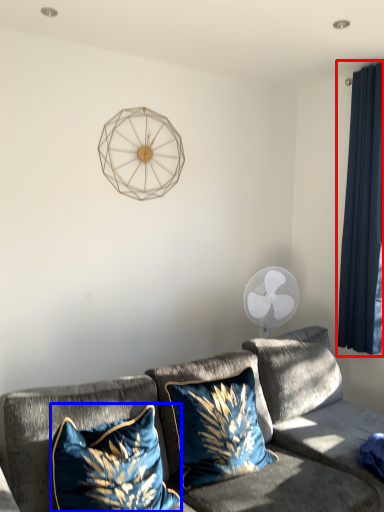
Question: Which of the following is the closest to the observer, curtain (highlighted by a red box) or pillow (highlighted by a blue box)?

Choices:
 (A) curtain
 (B) pillow

Answer: (B)